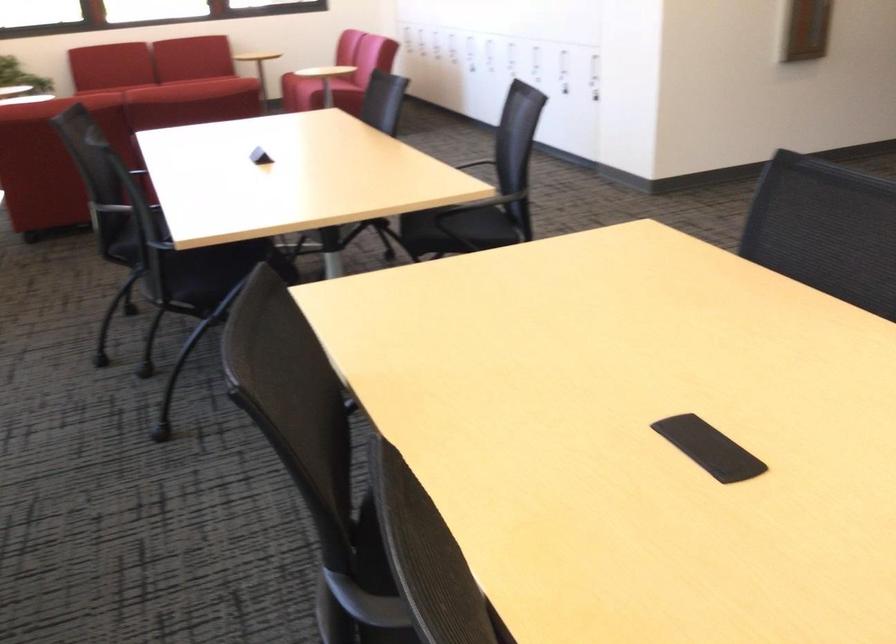
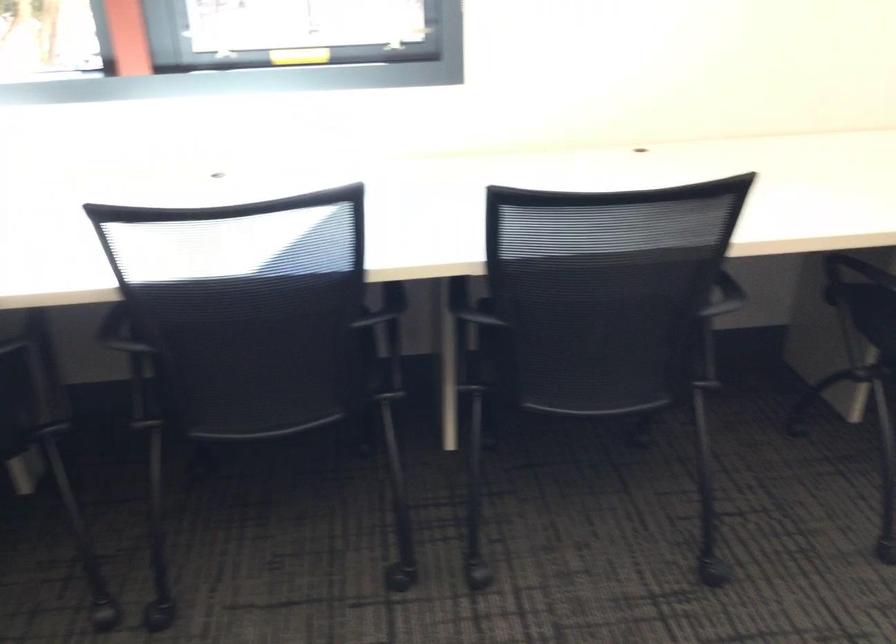
First-person continuous shooting, in which direction is the camera rotating?

The rotation direction of the camera is left-down.